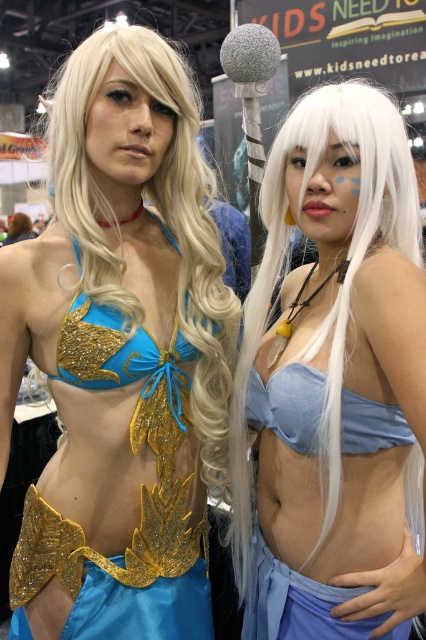
Question: Is matte blue bikini top at center in front of blue satin bikini top at center?

Choices:
 (A) yes
 (B) no

Answer: (A)

Question: Which of the following is the closest to the observer?

Choices:
 (A) matte blue bikini top at center
 (B) blue satin bikini top at center

Answer: (A)

Question: Which object is positioned closest to the matte gold bikini top at center?

Choices:
 (A) matte blue bikini top at center
 (B) blue satin bikini top at center

Answer: (A)

Question: Is matte gold bikini top at center positioned at the back of matte blue bikini top at center?

Choices:
 (A) no
 (B) yes

Answer: (B)

Question: Which point is closer to the camera?

Choices:
 (A) matte blue bikini top at center
 (B) matte gold bikini top at center
 (C) blue satin bikini top at center

Answer: (A)

Question: Does matte gold bikini top at center have a lesser width compared to blue satin bikini top at center?

Choices:
 (A) yes
 (B) no

Answer: (B)